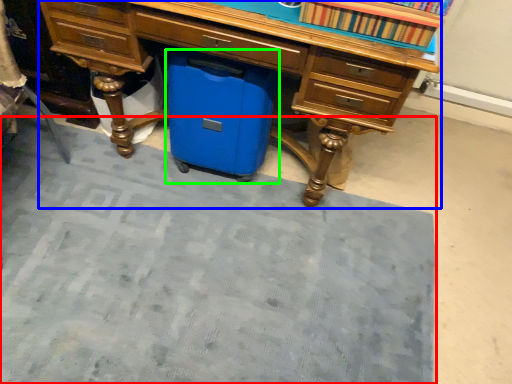
Question: Considering the real-world distances, which object is closest to doormat (highlighted by a red box)? desk (highlighted by a blue box) or cooler (highlighted by a green box).

Choices:
 (A) desk
 (B) cooler

Answer: (B)